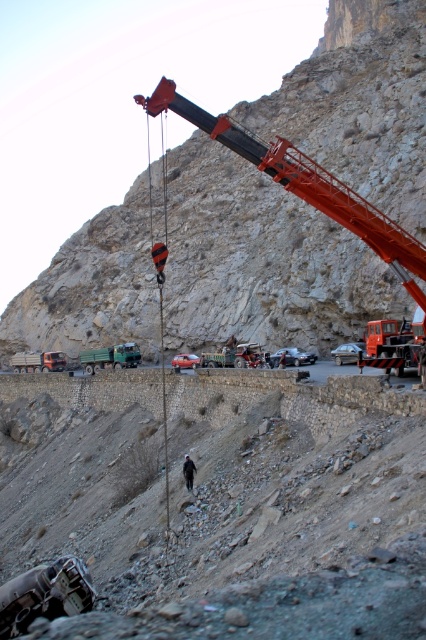
You are a construction worker on the rugged outdoor construction site. You need to move a heavy equipment from the metallic silver car at center to the rough stone hillside at upper center. Which direction should you move the equipment to reach the destination?

The rough stone hillside at upper center is above the metallic silver car at center, so you should move the equipment upward to reach the destination.

You are standing at the point marked by the coordinates point (184, 360) in the image. What object are you standing on?

The point (184, 360) corresponds to the metallic silver car at center, so you are standing on the metallic silver car at center.